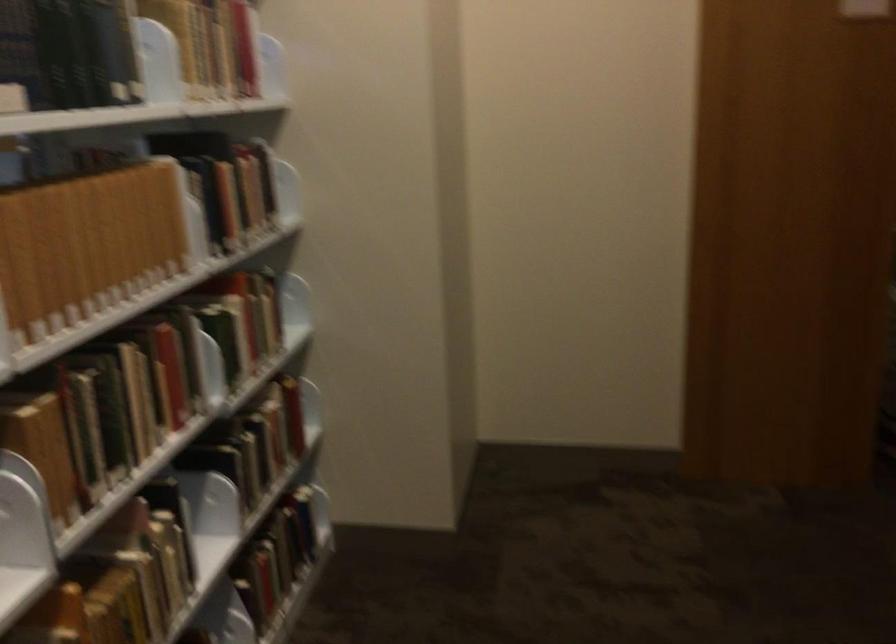
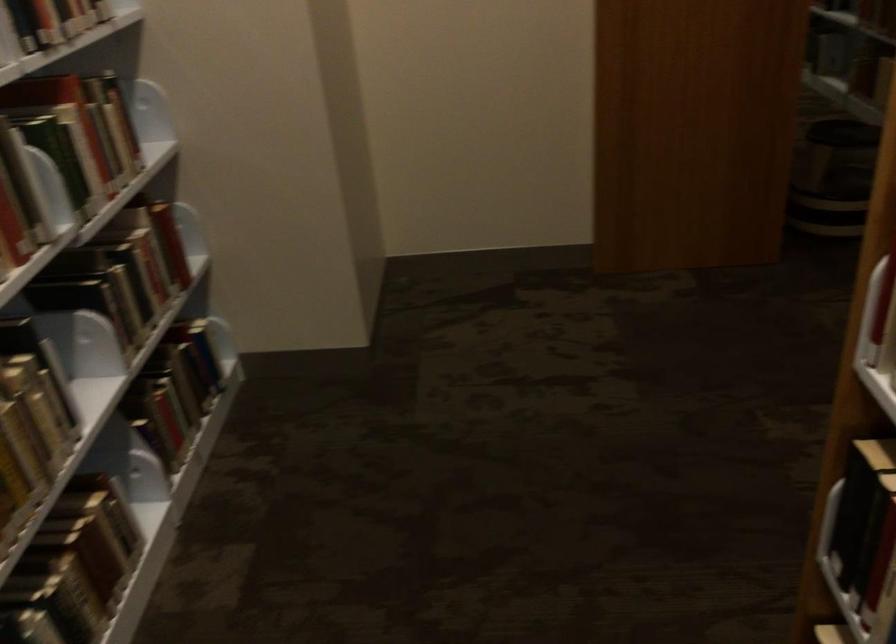
Find the pixel in the second image that matches [248,440] in the first image.

(119, 272)